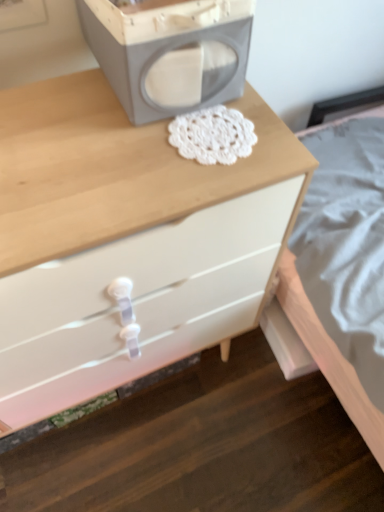
Question: Is matte gray speaker at upper center taller or shorter than white glossy chest of drawers at center?

Choices:
 (A) tall
 (B) short

Answer: (B)

Question: From a real-world perspective, is matte gray speaker at upper center positioned above or below white glossy chest of drawers at center?

Choices:
 (A) above
 (B) below

Answer: (A)

Question: Is matte gray speaker at upper center inside the boundaries of white glossy chest of drawers at center, or outside?

Choices:
 (A) inside
 (B) outside

Answer: (B)

Question: From the image's perspective, relative to matte gray speaker at upper center, is white glossy chest of drawers at center above or below?

Choices:
 (A) above
 (B) below

Answer: (B)

Question: Considering their positions, is white glossy chest of drawers at center located in front of or behind matte gray speaker at upper center?

Choices:
 (A) behind
 (B) front

Answer: (B)

Question: Looking at their shapes, would you say white glossy chest of drawers at center is wider or thinner than matte gray speaker at upper center?

Choices:
 (A) thin
 (B) wide

Answer: (B)

Question: Considering the positions of point (241, 161) and point (152, 65), is point (241, 161) closer or farther from the camera than point (152, 65)?

Choices:
 (A) farther
 (B) closer

Answer: (A)